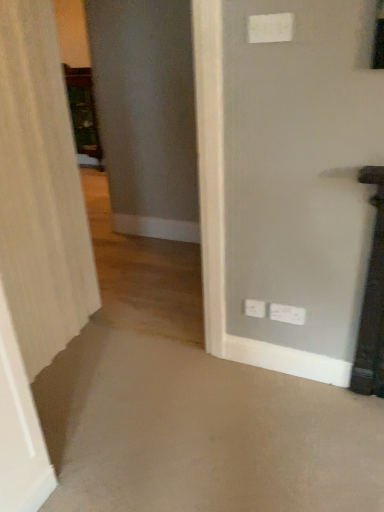
Question: Considering their positions, is white plastic electric outlet at lower right, the first electric outlet from the back, located in front of or behind white textured curtain at left?

Choices:
 (A) behind
 (B) front

Answer: (A)

Question: Do you think white plastic electric outlet at lower right, the first electric outlet from the back, is within white textured curtain at left, or outside of it?

Choices:
 (A) inside
 (B) outside

Answer: (B)

Question: Which of these objects is positioned farthest from the white plastic electric outlet at upper center, arranged as the third electric outlet when viewed from the back?

Choices:
 (A) white plastic electric outlet at lower right, which is the 2th electric outlet from top to bottom
 (B) white plastic electric outlet at lower right, which is the 2th electric outlet in back-to-front order
 (C) white textured curtain at left
 (D) wooden cabinet at left

Answer: (D)

Question: Which of these objects is positioned farthest from the white textured curtain at left?

Choices:
 (A) white plastic electric outlet at upper center, the 3th electric outlet positioned from the bottom
 (B) white plastic electric outlet at lower right, placed as the 2th electric outlet when sorted from bottom to top
 (C) wooden cabinet at left
 (D) white plastic electric outlet at lower right, which is the 2th electric outlet in back-to-front order

Answer: (C)